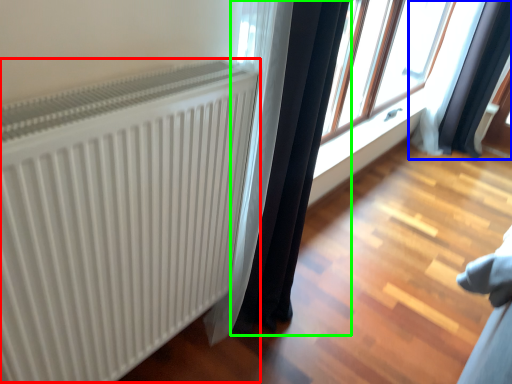
Question: Which is nearer to the radiator (highlighted by a red box)? curtain (highlighted by a blue box) or curtain (highlighted by a green box).

Choices:
 (A) curtain
 (B) curtain

Answer: (B)